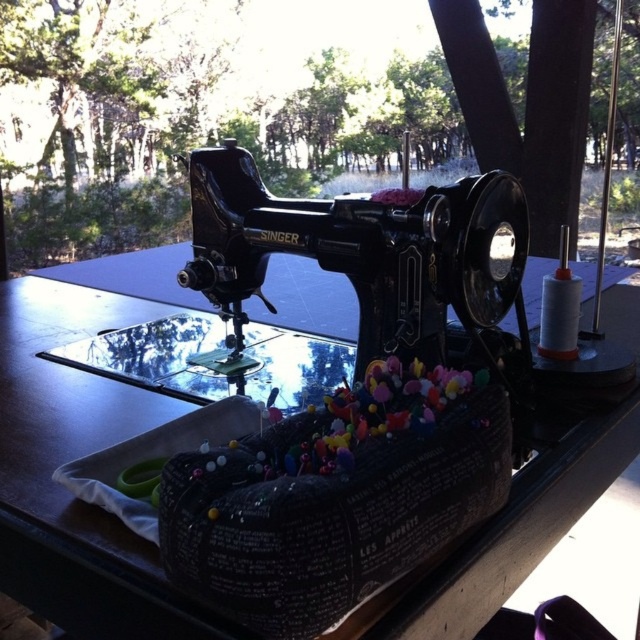
Question: Which object appears closest to the camera in this image?

Choices:
 (A) black fabric with pins at center
 (B) black metal sewing machine at center
 (C) black wood table at center
 (D) transparent glass table at center

Answer: (A)

Question: Which point is closer to the camera taking this photo?

Choices:
 (A) (374, 317)
 (B) (269, 442)
 (C) (195, 342)

Answer: (B)

Question: Based on their relative distances, which object is nearer to the black wood table at center?

Choices:
 (A) transparent glass table at center
 (B) black fabric with pins at center

Answer: (A)

Question: Is black fabric with pins at center above transparent glass table at center?

Choices:
 (A) yes
 (B) no

Answer: (B)

Question: From the image, what is the correct spatial relationship of black wood table at center in relation to black fabric with pins at center?

Choices:
 (A) above
 (B) below

Answer: (A)

Question: In this image, where is black wood table at center located relative to black metal sewing machine at center?

Choices:
 (A) above
 (B) below

Answer: (B)